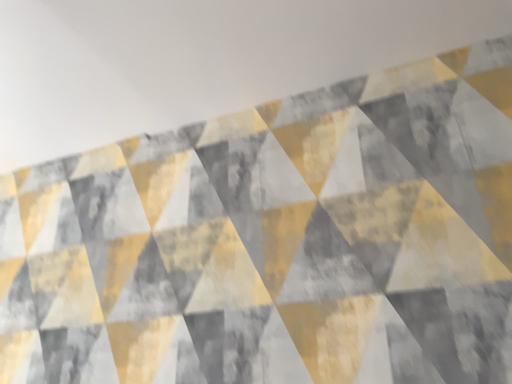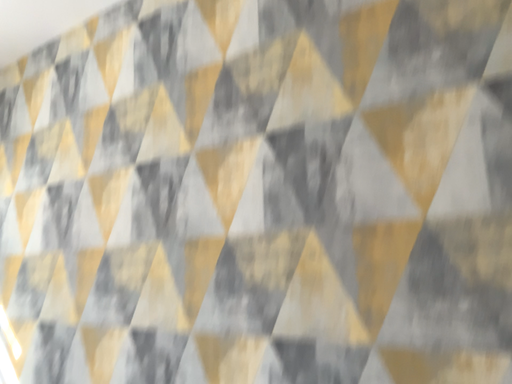
Question: Which way did the camera rotate in the video?

Choices:
 (A) rotated left
 (B) rotated right

Answer: (A)